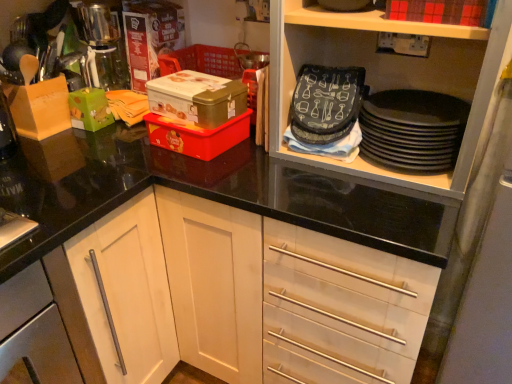
Question: From a real-world perspective, is silver metallic cabinet handle at lower left on black matte plates at upper right?

Choices:
 (A) no
 (B) yes

Answer: (A)

Question: Is silver metallic cabinet handle at lower left far from black matte plates at upper right?

Choices:
 (A) yes
 (B) no

Answer: (B)

Question: Does silver metallic cabinet handle at lower left have a smaller size compared to black matte plates at upper right?

Choices:
 (A) no
 (B) yes

Answer: (A)

Question: Is the position of silver metallic cabinet handle at lower left less distant than that of black matte plates at upper right?

Choices:
 (A) yes
 (B) no

Answer: (A)

Question: Is silver metallic cabinet handle at lower left outside of black matte plates at upper right?

Choices:
 (A) yes
 (B) no

Answer: (A)

Question: From a real-world perspective, relative to red matte box at upper right, which is the first box in right-to-left order, is brushed metal coffee machine at upper left vertically above or below?

Choices:
 (A) below
 (B) above

Answer: (A)

Question: In the image, is brushed metal coffee machine at upper left positioned in front of or behind red matte box at upper right, which is the first box in right-to-left order?

Choices:
 (A) front
 (B) behind

Answer: (B)

Question: From their relative heights in the image, would you say brushed metal coffee machine at upper left is taller or shorter than red matte box at upper right, which is the first box in right-to-left order?

Choices:
 (A) tall
 (B) short

Answer: (A)

Question: Is point (114, 46) closer or farther from the camera than point (435, 11)?

Choices:
 (A) closer
 (B) farther

Answer: (B)

Question: From a real-world perspective, relative to metallic gold box at center, which is the third box in right-to-left order, is black matte plates at upper right vertically above or below?

Choices:
 (A) below
 (B) above

Answer: (A)

Question: In terms of width, does black matte plates at upper right look wider or thinner when compared to metallic gold box at center, which is counted as the second box, starting from the left?

Choices:
 (A) thin
 (B) wide

Answer: (B)

Question: Is black matte plates at upper right situated inside metallic gold box at center, which is the third box in right-to-left order, or outside?

Choices:
 (A) outside
 (B) inside

Answer: (A)

Question: From their relative heights in the image, would you say black matte plates at upper right is taller or shorter than metallic gold box at center, which is counted as the second box, starting from the left?

Choices:
 (A) tall
 (B) short

Answer: (A)

Question: Visually, is red matte box at upper right, which is the first box in right-to-left order, positioned to the left or to the right of green matte box at left, which ranks as the fourth box in right-to-left order?

Choices:
 (A) right
 (B) left

Answer: (A)

Question: Does point (460, 6) appear closer or farther from the camera than point (109, 110)?

Choices:
 (A) farther
 (B) closer

Answer: (B)